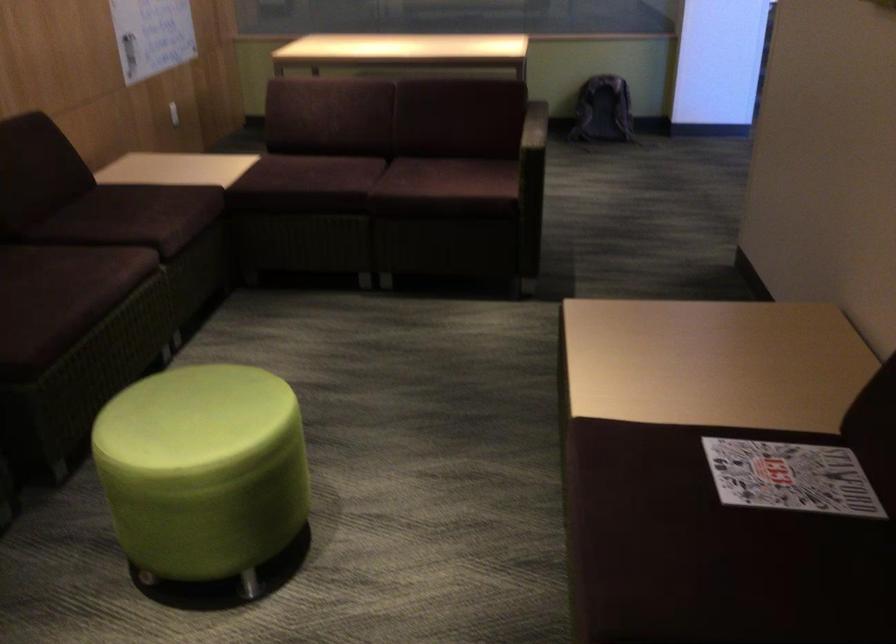
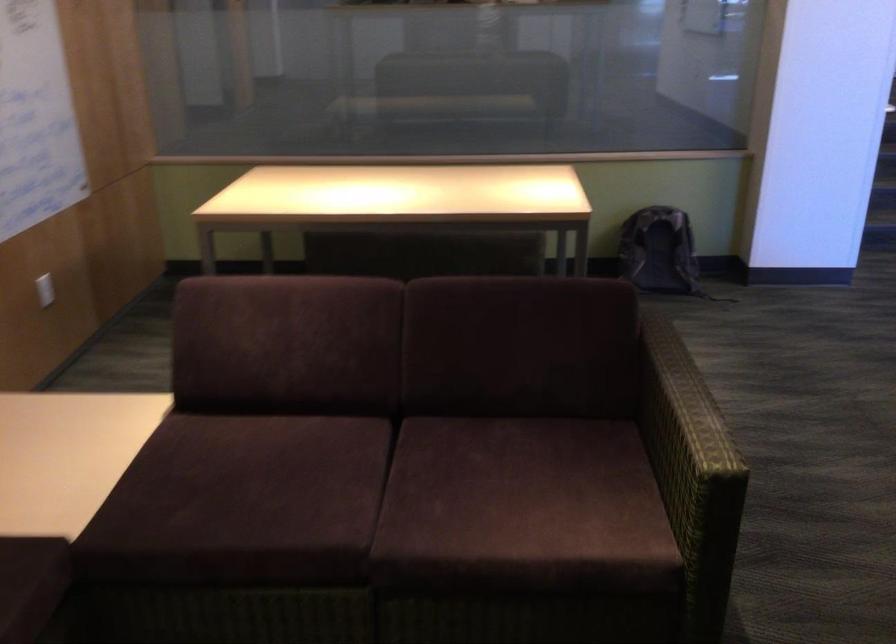
Question: I am providing you with two images of the same scene from different viewpoints. Which of the following objects are not visible in image2?

Choices:
 (A) white light switch
 (B) sofa sitting surface
 (C) gray backpack
 (D) none of these

Answer: (D)